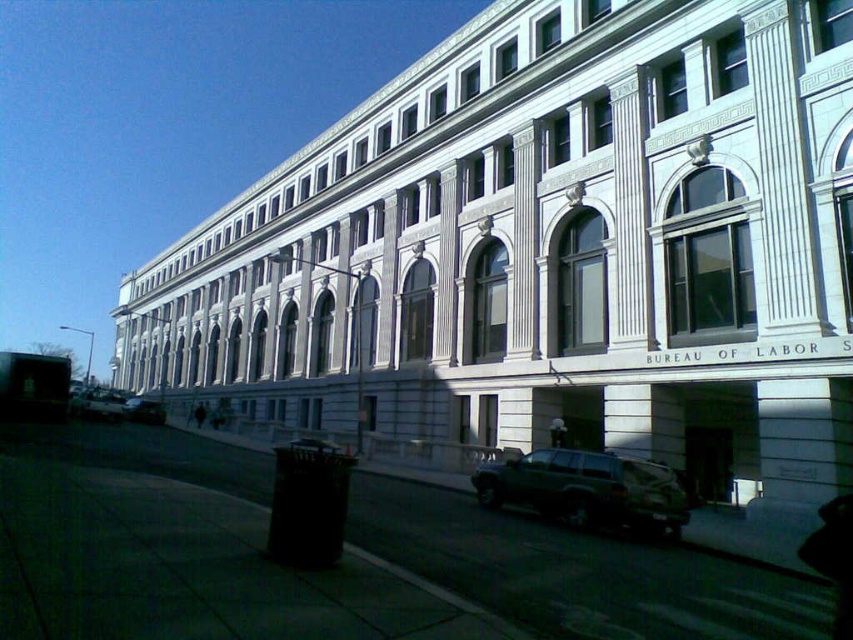
You are standing on the sidewalk in front of the Bureau of Labor building. You notice a point marked at coordinates (587, 490). Which object does this point correspond to?

The point at coordinates (587, 490) corresponds to the dark green matte suv at lower center.

You are a delivery person trying to park your metallic silver suv at lower left near the building. However, there is another silver metallic suv at lower left already occupying the spot. According to the image, which suv should you park behind to avoid blocking the other?

The metallic silver suv at lower left should be parked behind the silver metallic suv at lower left since it is positioned above it in the image, indicating it is closer to the building and you can park behind it without blocking.

You are a delivery person needing to park your vehicle. You see a dark green matte suv at lower center and a metallic silver suv at lower left. Which SUV is closer to the sidewalk on the right side of the street?

The dark green matte suv at lower center is above the metallic silver suv at lower left, so the metallic silver suv at lower left is closer to the sidewalk on the right side of the street.